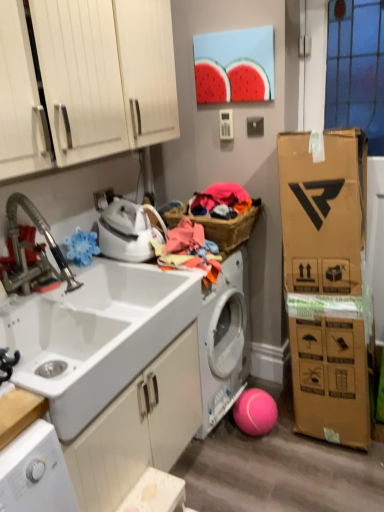
The height and width of the screenshot is (512, 384). What do you see at coordinates (126, 228) in the screenshot? I see `white glossy iron at upper left` at bounding box center [126, 228].

You are a GUI agent. You are given a task and a screenshot of the screen. Output one action in this format:
    pyautogui.click(x=<x>, y=<y>)
    Task: Click on the white matte cabinet at lower center, the second cabinetry viewed from the top
    This screenshot has height=512, width=384.
    Given the screenshot: What is the action you would take?
    pyautogui.click(x=139, y=428)

At what (x,y) coordinates should I click in order to perform the action: click on white matte washing machine at center. Please return your answer as a coordinate pair (x, y). Looking at the image, I should click on (224, 340).

Can you tell me how much white glossy iron at upper left and white matte cabinet at lower center, the second cabinetry viewed from the top, differ in facing direction?

The angular difference between white glossy iron at upper left and white matte cabinet at lower center, the second cabinetry viewed from the top, is 8.16 degrees.

From a real-world perspective, is white glossy iron at upper left over white matte cabinet at lower center, the second cabinetry viewed from the top?

Yes, from a real-world perspective, white glossy iron at upper left is above white matte cabinet at lower center, the second cabinetry viewed from the top.

Which is nearer, (147, 211) or (102, 470)?

The point (102, 470) is in front.

Consider the image. Are white matte cabinet at lower center, the second cabinetry viewed from the top, and white glossy iron at upper left making contact?

No, white matte cabinet at lower center, the second cabinetry viewed from the top, is not next to white glossy iron at upper left.

From a real-world perspective, is white matte cabinet at lower center, the second cabinetry viewed from the top, on top of white glossy iron at upper left?

No.

Is white matte cabinet at lower center, the first cabinetry positioned from the bottom, wider or thinner than white glossy iron at upper left?

In the image, white matte cabinet at lower center, the first cabinetry positioned from the bottom, appears to be wider than white glossy iron at upper left.

Is white matte cabinet at lower center, the first cabinetry positioned from the bottom, facing towards white glossy iron at upper left?

No, white matte cabinet at lower center, the first cabinetry positioned from the bottom, is not turned towards white glossy iron at upper left.

Considering the positions of objects multicolored fabric at center and white matte washing machine at center in the image provided, who is more to the left, multicolored fabric at center or white matte washing machine at center?

From the viewer's perspective, multicolored fabric at center appears more on the left side.

Is white matte washing machine at center completely or partially inside multicolored fabric at center?

That's incorrect, white matte washing machine at center is not inside multicolored fabric at center.

Looking at this image, which is closer to the camera, (190, 262) or (218, 282)?

Point (190, 262).

From the picture: Is multicolored fabric at center positioned in front of white matte washing machine at center?

That is True.

Which object is further away from the camera taking this photo, multicolored fabric at center or white matte cabinet at lower center, the second cabinetry viewed from the top?

multicolored fabric at center is more distant.

Considering the sizes of objects multicolored fabric at center and white matte cabinet at lower center, the second cabinetry viewed from the top, in the image provided, who is bigger, multicolored fabric at center or white matte cabinet at lower center, the second cabinetry viewed from the top,?

white matte cabinet at lower center, the second cabinetry viewed from the top, is bigger.

Are multicolored fabric at center and white matte cabinet at lower center, the second cabinetry viewed from the top, making contact?

No, multicolored fabric at center is not making contact with white matte cabinet at lower center, the second cabinetry viewed from the top.

Considering the relative sizes of multicolored fabric at center and white matte cabinet at lower center, the first cabinetry positioned from the bottom, in the image provided, is multicolored fabric at center shorter than white matte cabinet at lower center, the first cabinetry positioned from the bottom,?

Indeed, multicolored fabric at center has a lesser height compared to white matte cabinet at lower center, the first cabinetry positioned from the bottom.

Would you say white glossy iron at upper left is part of white glossy cabinet doors at upper left, arranged as the 2th cabinetry when ordered from the bottom,'s contents?

Definitely not — white glossy iron at upper left is not inside white glossy cabinet doors at upper left, arranged as the 2th cabinetry when ordered from the bottom.

Which of these two, white glossy cabinet doors at upper left, positioned as the 1th cabinetry in top-to-bottom order, or white glossy iron at upper left, stands shorter?

white glossy iron at upper left.

Is white glossy cabinet doors at upper left, arranged as the 2th cabinetry when ordered from the bottom, aimed at white glossy iron at upper left?

No, white glossy cabinet doors at upper left, arranged as the 2th cabinetry when ordered from the bottom, is not aimed at white glossy iron at upper left.

Considering the relative positions of white glossy cabinet doors at upper left, positioned as the 1th cabinetry in top-to-bottom order, and white glossy iron at upper left in the image provided, is white glossy cabinet doors at upper left, positioned as the 1th cabinetry in top-to-bottom order, to the left or to the right of white glossy iron at upper left?

Clearly, white glossy cabinet doors at upper left, positioned as the 1th cabinetry in top-to-bottom order, is on the left of white glossy iron at upper left in the image.

Which point is more distant from viewer, (239, 277) or (11, 221)?

The point (239, 277) is behind.

Is white matte washing machine at center far away from white glossy sink at left?

No.

From a real-world perspective, is white matte washing machine at center over white glossy sink at left?

No.

What's the angular difference between white matte washing machine at center and white glossy sink at left's facing directions?

0.343 degrees.

From a real-world perspective, is white glossy cabinet doors at upper left, arranged as the 2th cabinetry when ordered from the bottom, on top of brushed metal faucet at left?

Correct, in the physical world, white glossy cabinet doors at upper left, arranged as the 2th cabinetry when ordered from the bottom, is higher than brushed metal faucet at left.

Are white glossy cabinet doors at upper left, positioned as the 1th cabinetry in top-to-bottom order, and brushed metal faucet at left located far from each other?

They are positioned close to each other.

Which is behind, white glossy cabinet doors at upper left, arranged as the 2th cabinetry when ordered from the bottom, or brushed metal faucet at left?

brushed metal faucet at left is further from the camera.

Based on the photo, can you tell me how much white glossy cabinet doors at upper left, positioned as the 1th cabinetry in top-to-bottom order, and brushed metal faucet at left differ in facing direction?

white glossy cabinet doors at upper left, positioned as the 1th cabinetry in top-to-bottom order, and brushed metal faucet at left are facing 11.3 degrees away from each other.

At what (x,y) coordinates should I click in order to perform the action: click on appliance behind the white matte cabinet at lower center, the second cabinetry viewed from the top. Please return your answer as a coordinate pair (x, y). Looking at the image, I should click on (126, 228).

In order to click on cabinetry directly beneath the white glossy iron at upper left (from a real-world perspective) in this screenshot , I will do click(139, 428).

Looking at the image, which one is located closer to white glossy iron at upper left, white glossy sink at left or brushed metal faucet at left?

Based on the image, white glossy sink at left appears to be nearer to white glossy iron at upper left.

Estimate the real-world distances between objects in this image. Which object is further from white glossy sink at left, multicolored fabric at center or white glossy iron at upper left?

Among the two, multicolored fabric at center is located further to white glossy sink at left.

Looking at the image, which one is located further to brushed metal faucet at left, white matte washing machine at center or multicolored fabric at center?

white matte washing machine at center lies further to brushed metal faucet at left than the other object.

Based on their spatial positions, is brushed metal faucet at left or white glossy sink at left closer to white glossy cabinet doors at upper left, arranged as the 2th cabinetry when ordered from the bottom?

The object closer to white glossy cabinet doors at upper left, arranged as the 2th cabinetry when ordered from the bottom, is brushed metal faucet at left.

Considering their positions, is white glossy sink at left positioned closer to white glossy cabinet doors at upper left, arranged as the 2th cabinetry when ordered from the bottom, than multicolored fabric at center?

Based on the image, white glossy sink at left appears to be nearer to white glossy cabinet doors at upper left, arranged as the 2th cabinetry when ordered from the bottom.

When comparing their distances from white glossy sink at left, does white matte washing machine at center or brushed metal faucet at left seem closer?

Based on the image, brushed metal faucet at left appears to be nearer to white glossy sink at left.

From the image, which object appears to be farther from multicolored fabric at center, white matte washing machine at center or white glossy iron at upper left?

white matte washing machine at center.

In the scene shown: Estimate the real-world distances between objects in this image. Which object is closer to multicolored fabric at center, white glossy cabinet doors at upper left, arranged as the 2th cabinetry when ordered from the bottom, or white glossy sink at left?

white glossy sink at left is positioned closer to the anchor multicolored fabric at center.

Locate an element on the screen. Image resolution: width=384 pixels, height=512 pixels. clothing between brushed metal faucet at left and woven wicker basket at center in the horizontal direction is located at coordinates (189, 251).

The width and height of the screenshot is (384, 512). I want to click on clothing between white glossy iron at upper left and woven wicker basket at center in the horizontal direction, so [x=189, y=251].

Identify the location of faucet positioned between white glossy sink at left and woven wicker basket at center from near to far. (33, 250).

Where is `clothing between brushed metal faucet at left and white matte washing machine at center in the horizontal direction`? The image size is (384, 512). clothing between brushed metal faucet at left and white matte washing machine at center in the horizontal direction is located at coordinates (189, 251).